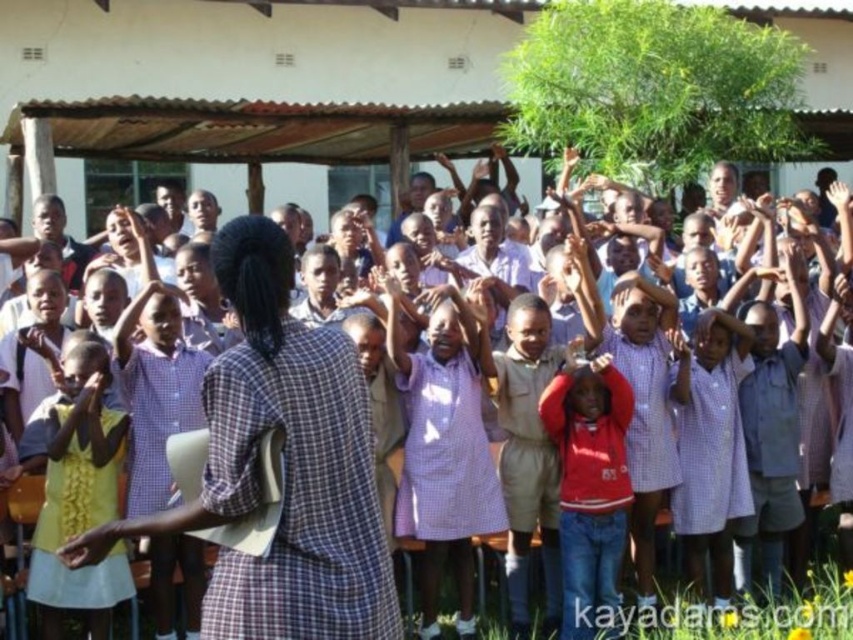
You are a photographer trying to capture a clear shot of the red fleece jacket at center without the yellow fabric hand at lower left blocking it. Based on their positions, is this possible?

The red fleece jacket at center is positioned under the yellow fabric hand at lower left, so the hand is blocking the jacket. To capture a clear shot of the red fleece jacket at center without the yellow fabric hand at lower left blocking it, you would need to adjust your angle or have the hand moved.

You are a student in the group and want to know which of the two points, point (589, 371) or point (90, 392), is closer to you. Based on the scene, which one would you say is nearer?

Point (90, 392) is closer to you because it is in front of point (589, 371).